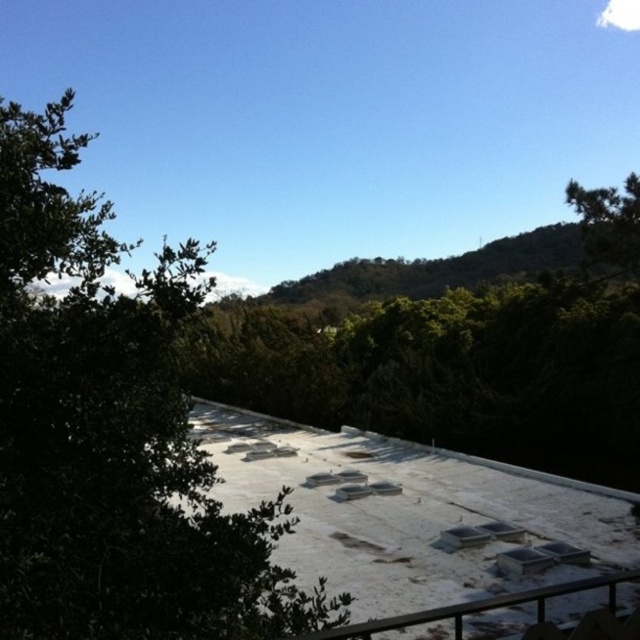
You are standing on the white rooftop and looking out. You see a green leafy tree at upper right and a white matte rail at lower right. Which object is positioned more to the right side of your view?

The green leafy tree at upper right is positioned more to the right side of your view than the white matte rail at lower right.

You are standing on the white rooftop and looking towards the point marked at coordinates (113, 435). What object or feature is located at that position?

The point at coordinates (113, 435) corresponds to a green leafy tree at the left side of the scene.